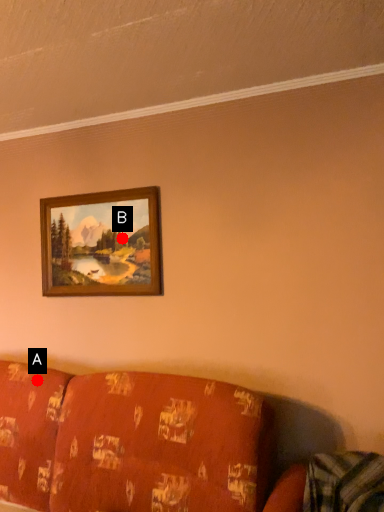
Question: Two points are circled on the image, labeled by A and B beside each circle. Which point is farther from the camera taking this photo?

Choices:
 (A) A is further
 (B) B is further

Answer: (B)